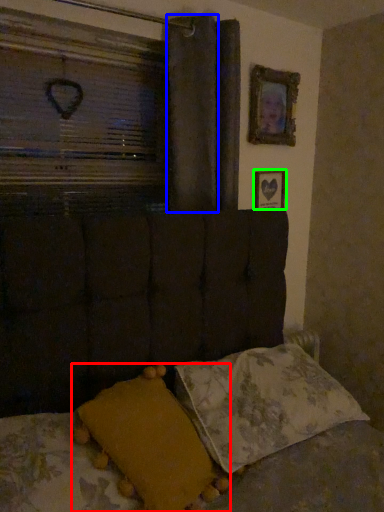
Question: Which object is positioned closest to pillow (highlighted by a red box)? Select from curtain (highlighted by a blue box) and picture frame (highlighted by a green box).

Choices:
 (A) curtain
 (B) picture frame

Answer: (A)